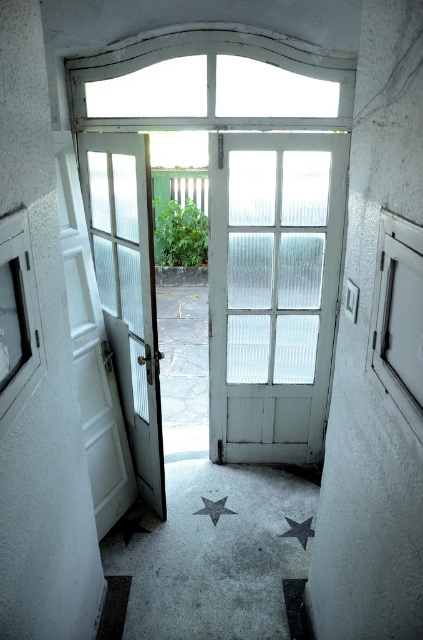
Question: Which object appears farthest from the camera in this image?

Choices:
 (A) transparent glass window at right
 (B) metallic silver star at center
 (C) white frosted glass window at left

Answer: (B)

Question: Which point is closer to the camera?

Choices:
 (A) (0, 262)
 (B) (225, 497)
 (C) (140, 518)

Answer: (A)

Question: Does metallic gray star at center come behind metallic silver star at center?

Choices:
 (A) no
 (B) yes

Answer: (A)

Question: In this image, where is white frosted glass window at left located relative to metallic star at lower center?

Choices:
 (A) above
 (B) below

Answer: (A)

Question: Considering the real-world distances, which object is closest to the metallic star at lower center?

Choices:
 (A) metallic silver star at center
 (B) white frosted glass door at left
 (C) white frosted glass window at left
 (D) metallic gray star at center

Answer: (A)

Question: From the image, what is the correct spatial relationship of white frosted glass door at center in relation to white frosted glass window at left?

Choices:
 (A) above
 (B) below

Answer: (A)